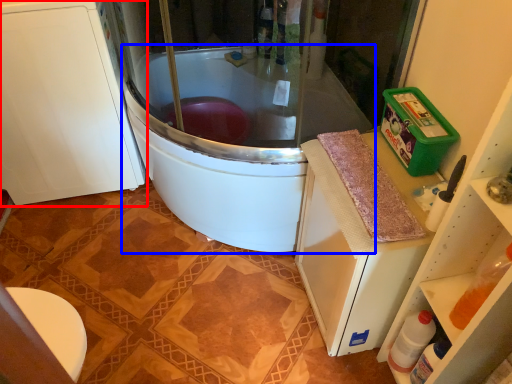
Question: Among these objects, which one is nearest to the camera, cabinetry (highlighted by a red box) or bathtub (highlighted by a blue box)?

Choices:
 (A) cabinetry
 (B) bathtub

Answer: (B)